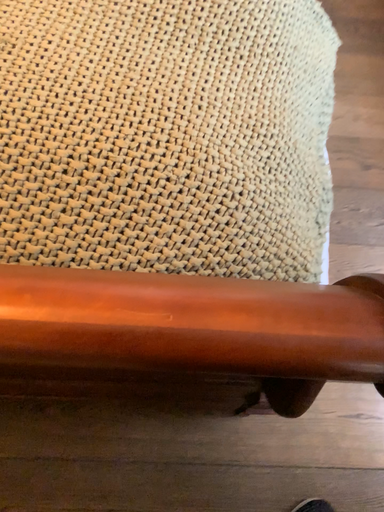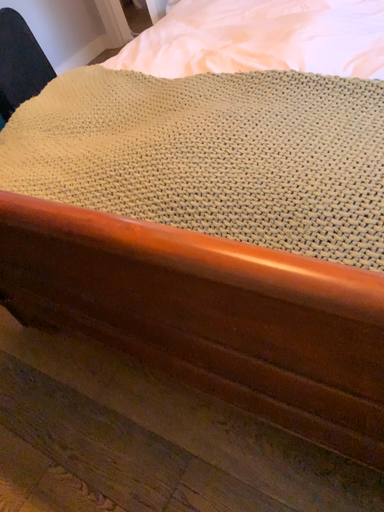
Question: Which way did the camera rotate in the video?

Choices:
 (A) rotated right
 (B) rotated left

Answer: (B)